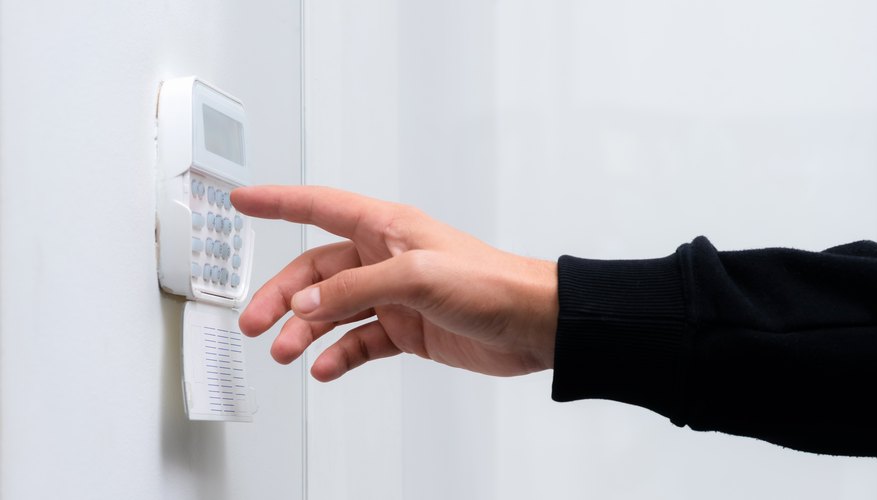
Where is `white wall`? This screenshot has height=500, width=877. white wall is located at coordinates (77, 327), (431, 166).